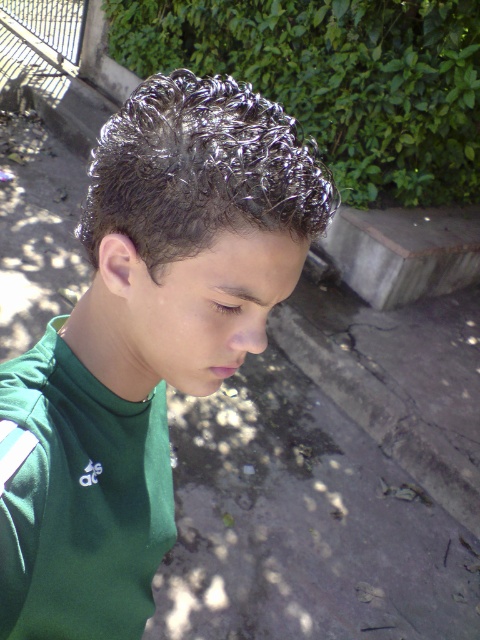
Does green matte shirt at center appear on the left side of shiny metallic hair at upper center?

Correct, you'll find green matte shirt at center to the left of shiny metallic hair at upper center.

Between green matte shirt at center and shiny metallic hair at upper center, which one appears on the right side from the viewer's perspective?

Positioned to the right is shiny metallic hair at upper center.

Who is more forward, (22, 492) or (193, 109)?

Point (193, 109)

Locate an element on the screen. The height and width of the screenshot is (640, 480). green matte shirt at center is located at coordinates (144, 342).